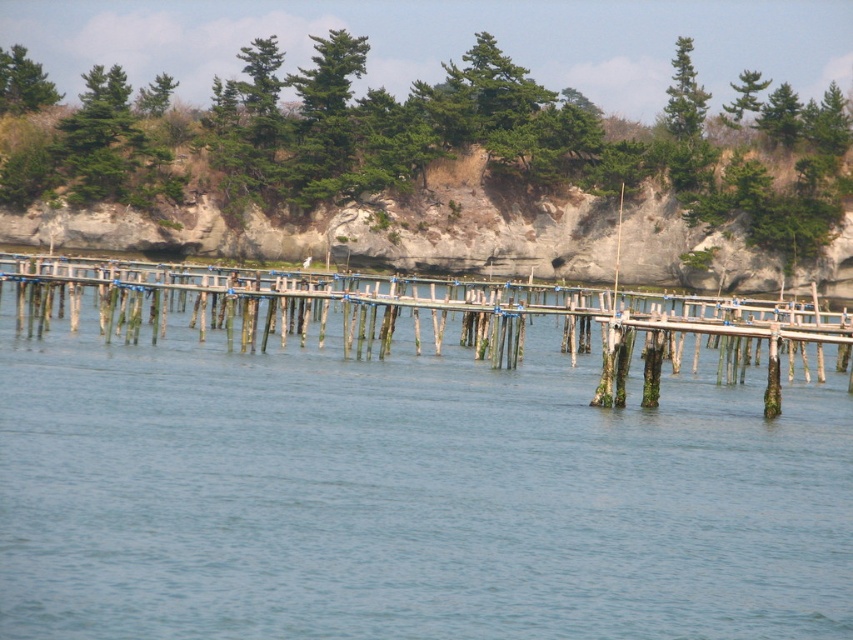
You are standing on the wooden pier and looking towards the rocky cliff. There are two points marked on the pier at coordinates point (215, 209) and point (247, 284). Which point is closer to you as you face the cliff?

Point (215, 209) is closer to you because it is further to the camera than point (247, 284), meaning it is nearer to your position on the pier.

You are standing on the wooden pier and want to throw a small stone into the clear blue water at center. If you can throw the stone 16 meters, will it reach the water?

The clear blue water at center is 16.70 meters away from the wooden pier. Since your throw can only reach 16 meters, the stone will not reach the water.